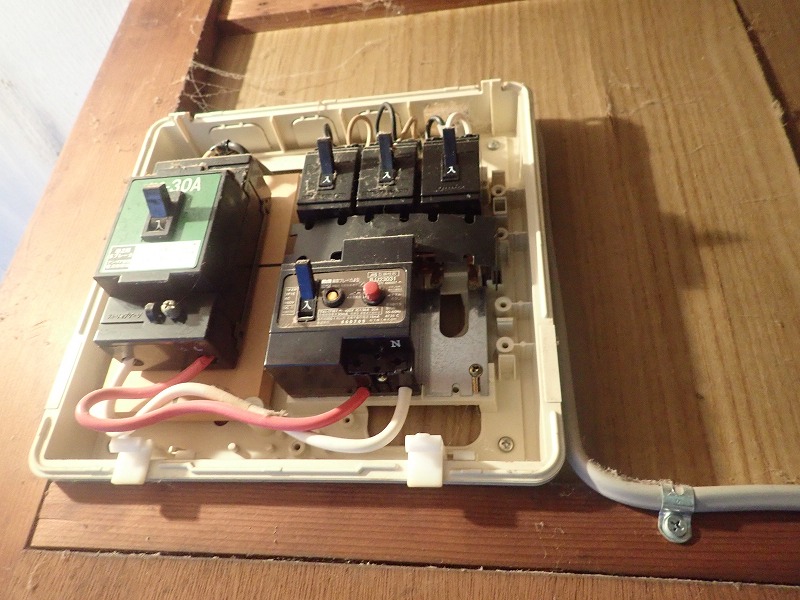
Locate an element on the screen. The height and width of the screenshot is (600, 800). panel is located at coordinates (548, 130), (58, 397), (521, 501), (386, 83).